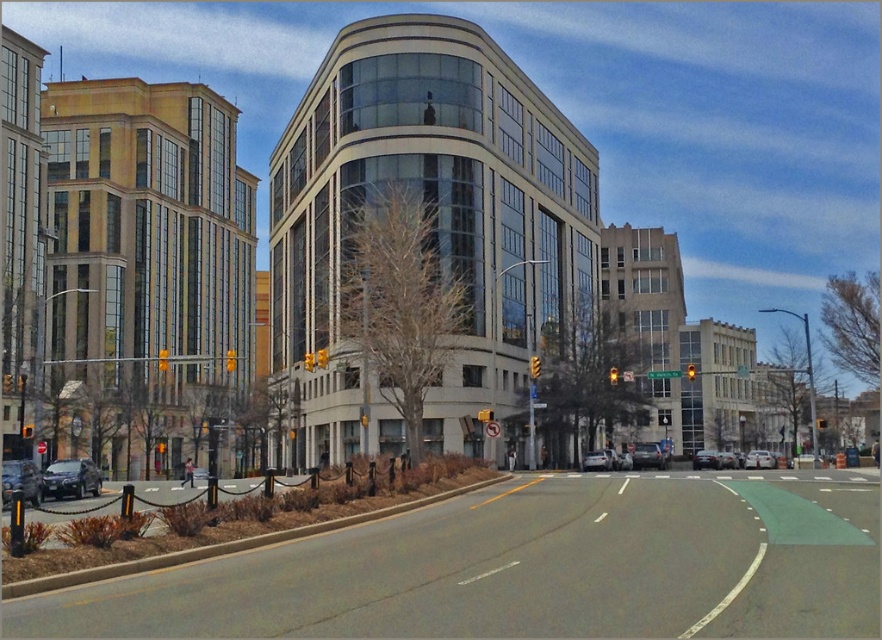
You are a delivery driver who needs to park your vehicle in a tight space between two cars. You see a silver metallic sedan at center and a matte black sedan at center. Which car should you avoid parking next to to ensure there is enough vertical clearance for your delivery van?

You should avoid parking next to the matte black sedan at center because it has a greater height than the silver metallic sedan at center, which might leave less vertical clearance for your delivery van.

You are a pedestrian standing at the median strip and want to cross the road to reach the modern buildings. There is a silver metallic sedan at center and a matte black sedan at center blocking your path. Which car should you move around to get to the buildings?

You should move around the matte black sedan at center because the silver metallic sedan at center is in front of it, meaning the matte black sedan is closer to you. By moving around the closer car, you can reach the buildings more directly.

You are a delivery driver who needs to park your vehicle in this area. You have a truck that is 2 meters wide. The shiny black sedan at lower left and the white matte car at center are already parked here. Can your truck fit between them without overlapping either car?

The shiny black sedan at lower left is wider than the white matte car at center. Since the truck is 2 meters wide, it depends on the space between them. However, the description only provides information about their widths, not the distance between them. Therefore, we cannot determine if the truck can fit based on the given information.